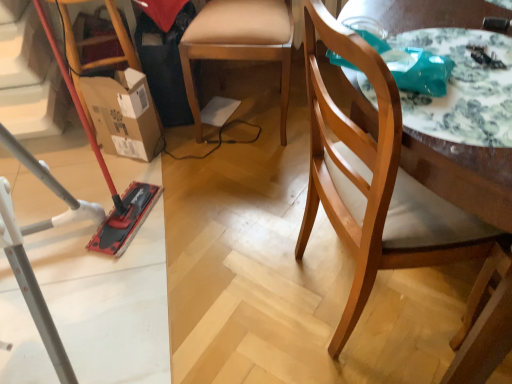
You are a GUI agent. You are given a task and a screenshot of the screen. Output one action in this format:
    pyautogui.click(x=<x>, y=<y>)
    Task: Click on the space that is in front of cardboard box at left
    The width and height of the screenshot is (512, 384).
    Given the screenshot: What is the action you would take?
    pyautogui.click(x=136, y=182)